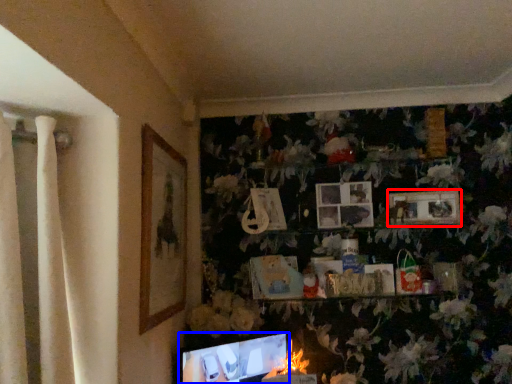
Question: Among these objects, which one is farthest to the camera, picture frame (highlighted by a red box) or computer monitor (highlighted by a blue box)?

Choices:
 (A) picture frame
 (B) computer monitor

Answer: (A)